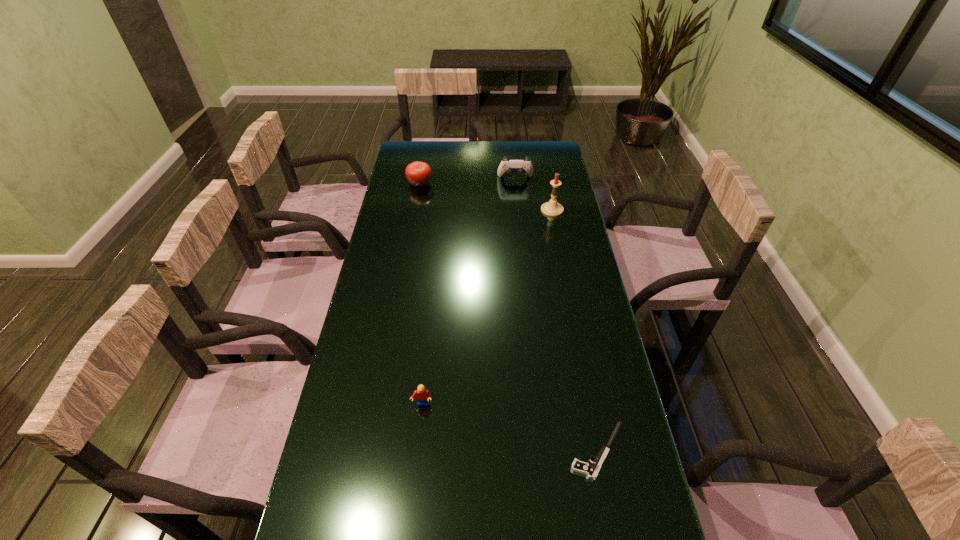
You are a GUI agent. You are given a task and a screenshot of the screen. Output one action in this format:
    pyautogui.click(x=<x>, y=<y>)
    Task: Click on the vacant position at the left edge of the desktop
    
    Given the screenshot: What is the action you would take?
    pyautogui.click(x=398, y=210)

This screenshot has height=540, width=960. Find the location of `free space at the right edge of the desktop`. free space at the right edge of the desktop is located at coordinates (564, 220).

The width and height of the screenshot is (960, 540). Find the location of `free region at the far left corner of the desktop`. free region at the far left corner of the desktop is located at coordinates (404, 150).

Identify the location of free space at the far right corner. (526, 142).

At what (x,y) coordinates should I click in order to perform the action: click on unoccupied area between the Lego and the control. Please return your answer as a coordinate pair (x, y). Looking at the image, I should click on (468, 292).

At what (x,y) coordinates should I click in order to perform the action: click on vacant space in between the control and the leftmost object. Please return your answer as a coordinate pair (x, y). Looking at the image, I should click on (468, 181).

In order to click on vacant point located between the control and the second nearest object in this screenshot , I will do `click(468, 292)`.

Where is `empty space between the control and the candle`? This screenshot has height=540, width=960. empty space between the control and the candle is located at coordinates (534, 194).

This screenshot has height=540, width=960. What are the coordinates of `free space between the apple and the nearest object` in the screenshot? It's located at (509, 317).

At what (x,y) coordinates should I click in order to perform the action: click on vacant space that's between the leftmost object and the nearest object. Please return your answer as a coordinate pair (x, y). The image size is (960, 540). Looking at the image, I should click on [x=509, y=317].